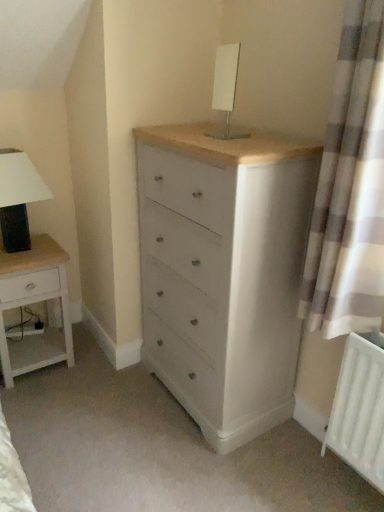
Locate an element on the screen. The height and width of the screenshot is (512, 384). vacant space in between white wood nightstand at left and white matte radiator at lower right is located at coordinates (163, 416).